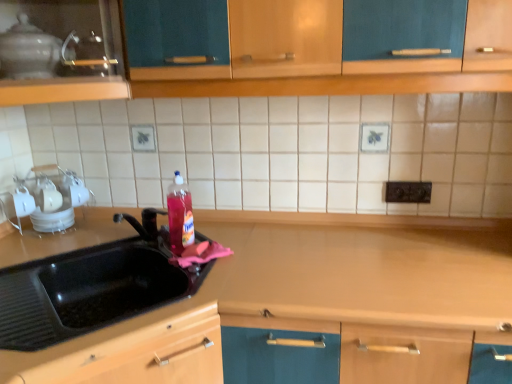
Question: From the image's perspective, is black rubber sink at left positioned above or below glass teapot at upper left, which is the 1th appliance in front-to-back order?

Choices:
 (A) above
 (B) below

Answer: (B)

Question: Would you say black rubber sink at left is to the left or to the right of glass teapot at upper left, which ranks as the 2th appliance in back-to-front order, in the picture?

Choices:
 (A) right
 (B) left

Answer: (A)

Question: Estimate the real-world distances between objects in this image. Which object is farther from the black plastic electric outlet at upper center?

Choices:
 (A) matte wood cabinet at upper left
 (B) glass teapot at upper left, the first appliance in the top-to-bottom sequence
 (C) translucent plastic bottle at sink
 (D) black rubber sink at left
 (E) wooden counter at center

Answer: (B)

Question: Estimate the real-world distances between objects in this image. Which object is closer to the wooden counter at center?

Choices:
 (A) glass teapot at upper left, which is the 1th appliance in front-to-back order
 (B) translucent plastic bottle at sink
 (C) white glossy dish rack at left, the 1th appliance from the back
 (D) black plastic electric outlet at upper center
 (E) matte wood cabinet at upper left

Answer: (D)